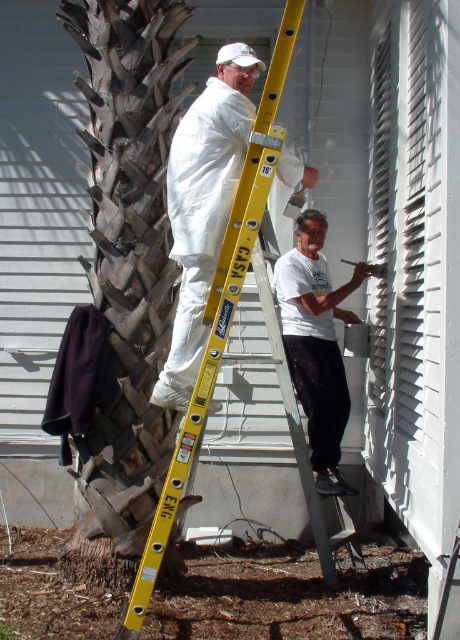
Can you confirm if white matte coveralls at center is wider than yellow metallic ladder at center?

Indeed, white matte coveralls at center has a greater width compared to yellow metallic ladder at center.

Is point (183, 253) farther from camera compared to point (188, 465)?

Yes, point (183, 253) is farther from viewer.

Find the location of a particular element. The image size is (460, 640). white matte coveralls at center is located at coordinates (203, 205).

Based on the photo, can you confirm if white matte coveralls at center is positioned to the left of white matte shirt at lower center?

Yes, white matte coveralls at center is to the left of white matte shirt at lower center.

Who is more distant from viewer, (286, 152) or (274, 273)?

The point (274, 273) is behind.

Locate an element on the screen. This screenshot has height=640, width=460. white matte coveralls at center is located at coordinates (203, 205).

Does dark brown textured bark at left appear on the right side of white matte coveralls at center?

In fact, dark brown textured bark at left is to the left of white matte coveralls at center.

I want to click on dark brown textured bark at left, so click(x=121, y=280).